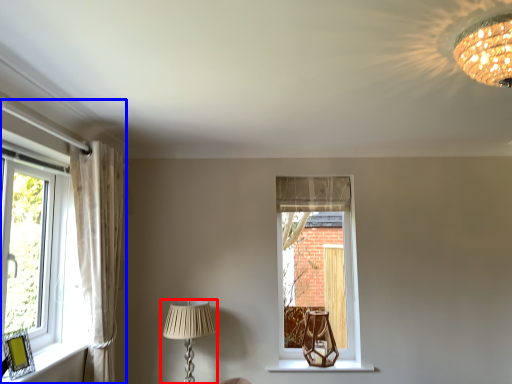
Question: Which of the following is the closest to the observer, lamp (highlighted by a red box) or window (highlighted by a blue box)?

Choices:
 (A) lamp
 (B) window

Answer: (B)